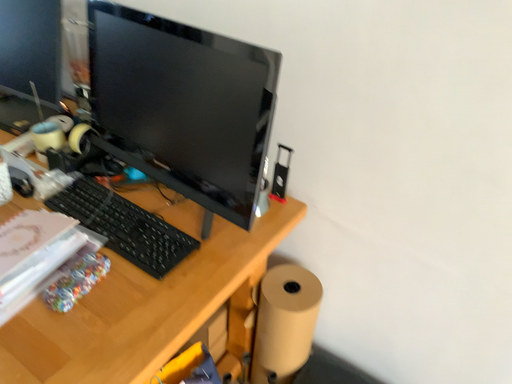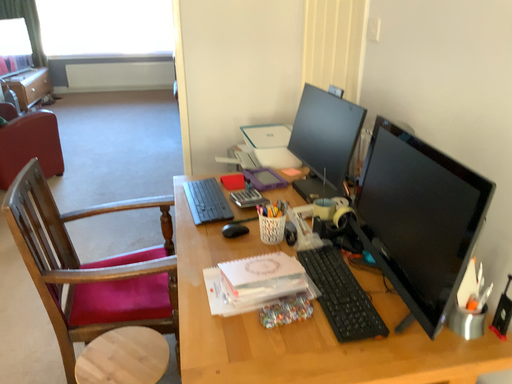
Question: How did the camera likely rotate when shooting the video?

Choices:
 (A) rotated upward
 (B) rotated downward

Answer: (A)